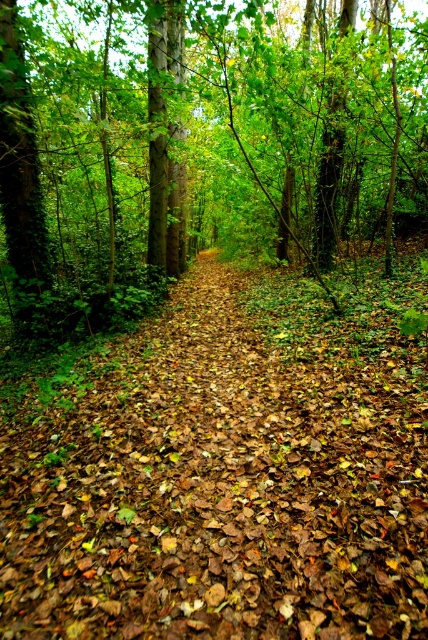
Question: Is brown leafy forest path at center behind brown leaf litter at center?

Choices:
 (A) no
 (B) yes

Answer: (A)

Question: Does brown leafy forest path at center have a smaller size compared to brown leaf litter at center?

Choices:
 (A) no
 (B) yes

Answer: (B)

Question: Which point is closer to the camera taking this photo?

Choices:
 (A) (398, 90)
 (B) (11, 413)

Answer: (B)

Question: Considering the relative positions of brown leafy forest path at center and brown leaf litter at center in the image provided, where is brown leafy forest path at center located with respect to brown leaf litter at center?

Choices:
 (A) right
 (B) left

Answer: (B)

Question: Which of the following is the closest to the observer?

Choices:
 (A) (267, 291)
 (B) (195, 214)

Answer: (A)